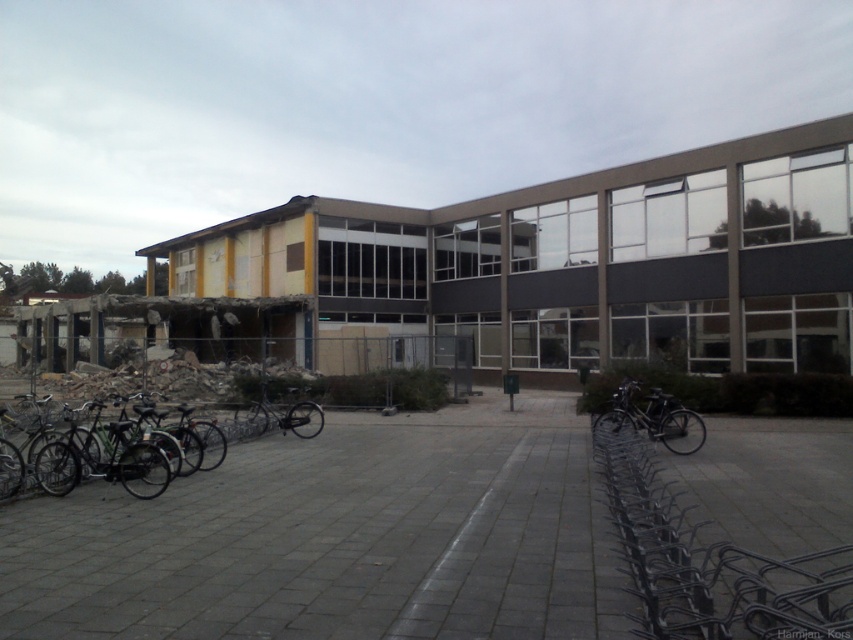
Question: Which of the following is the farthest from the observer?

Choices:
 (A) shiny metallic bicycle at center
 (B) metallic silver bike rack at lower right

Answer: (A)

Question: Does black matte bicycle at lower right have a larger size compared to shiny metallic bicycle at center?

Choices:
 (A) yes
 (B) no

Answer: (A)

Question: Can you confirm if metallic silver bike rack at lower right is positioned below black matte bicycle at lower right?

Choices:
 (A) no
 (B) yes

Answer: (A)

Question: From the image, what is the correct spatial relationship of metallic silver bike rack at lower right in relation to shiny black bicycle at left?

Choices:
 (A) above
 (B) below

Answer: (B)

Question: Which point appears closest to the camera in this image?

Choices:
 (A) (99, 474)
 (B) (686, 579)
 (C) (705, 435)
 (D) (314, 420)

Answer: (B)

Question: Which object is the farthest from the metallic silver bike rack at lower right?

Choices:
 (A) black matte bicycle at lower right
 (B) shiny metallic bicycle at center
 (C) shiny black bicycle at left

Answer: (B)